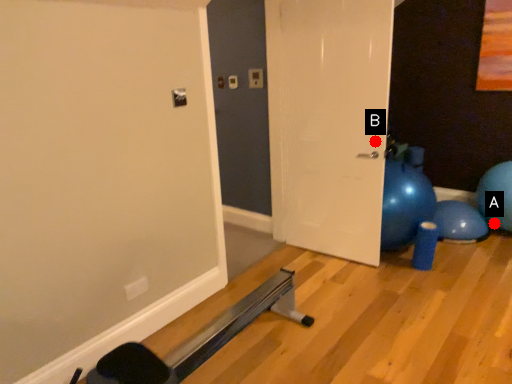
Question: Two points are circled on the image, labeled by A and B beside each circle. Which point is closer to the camera taking this photo?

Choices:
 (A) A is closer
 (B) B is closer

Answer: (B)